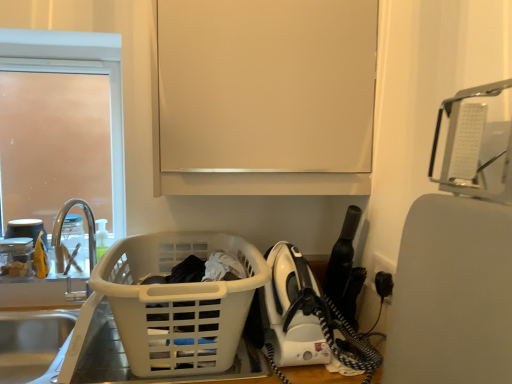
Question: Can you confirm if clear glass faucet at left is positioned to the left of translucent plastic bottle at sink left?

Choices:
 (A) no
 (B) yes

Answer: (B)

Question: Does clear glass faucet at left have a smaller size compared to translucent plastic bottle at sink left?

Choices:
 (A) yes
 (B) no

Answer: (B)

Question: Does clear glass faucet at left turn towards translucent plastic bottle at sink left?

Choices:
 (A) no
 (B) yes

Answer: (B)

Question: From a real-world perspective, is clear glass faucet at left positioned under translucent plastic bottle at sink left based on gravity?

Choices:
 (A) yes
 (B) no

Answer: (B)

Question: Is translucent plastic bottle at sink left at the back of clear glass faucet at left?

Choices:
 (A) yes
 (B) no

Answer: (A)

Question: Considering the relative sizes of clear glass faucet at left and translucent plastic bottle at sink left in the image provided, is clear glass faucet at left wider than translucent plastic bottle at sink left?

Choices:
 (A) yes
 (B) no

Answer: (A)

Question: Can you confirm if frosted glass door at upper left is smaller than white plastic iron at lower right?

Choices:
 (A) yes
 (B) no

Answer: (A)

Question: Is the depth of frosted glass door at upper left greater than that of white plastic iron at lower right?

Choices:
 (A) yes
 (B) no

Answer: (A)

Question: Can you confirm if frosted glass door at upper left is thinner than white plastic iron at lower right?

Choices:
 (A) no
 (B) yes

Answer: (B)

Question: Is the position of frosted glass door at upper left less distant than that of white plastic iron at lower right?

Choices:
 (A) yes
 (B) no

Answer: (B)

Question: Can you confirm if frosted glass door at upper left is positioned to the right of white plastic iron at lower right?

Choices:
 (A) yes
 (B) no

Answer: (B)

Question: Can you confirm if frosted glass door at upper left is positioned to the left of white plastic iron at lower right?

Choices:
 (A) no
 (B) yes

Answer: (B)

Question: Is translucent plastic bottle at sink left outside of white plastic laundry basket at lower left?

Choices:
 (A) no
 (B) yes

Answer: (B)